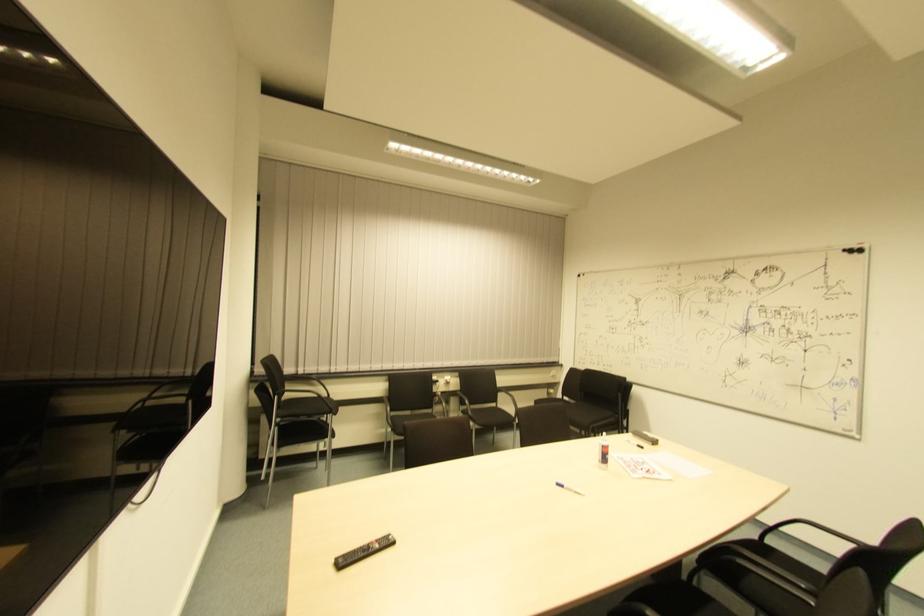
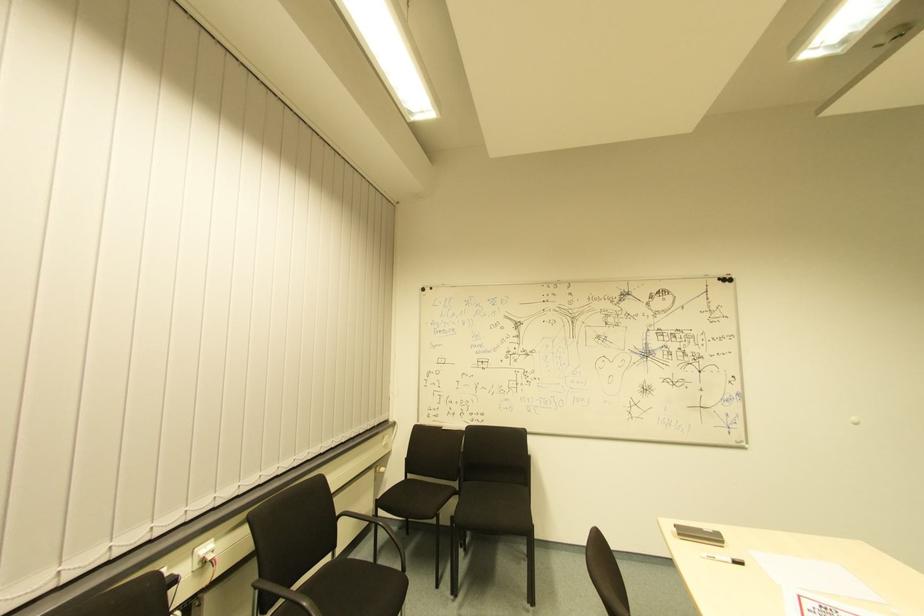
Find the pixel in the second image that matches the point at 579,278 in the first image.

(427, 293)